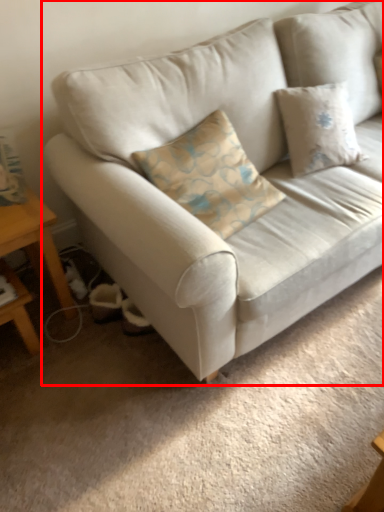
Question: From the image's perspective, where is studio couch (annotated by the red box) located relative to table?

Choices:
 (A) below
 (B) above

Answer: (B)